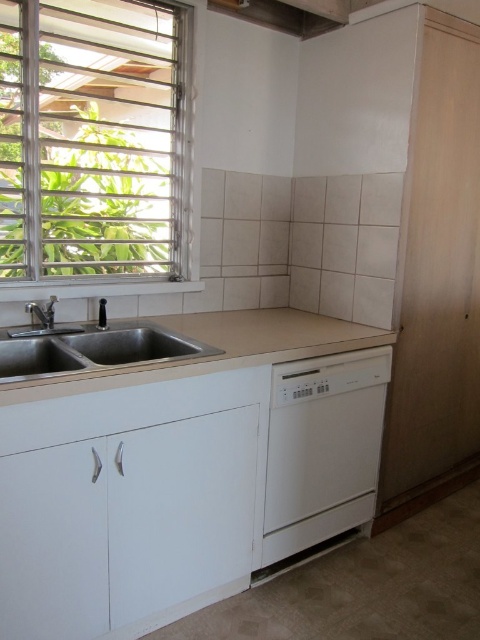
Who is positioned more to the right, stainless steel sink at lower left or brushed metal faucet at left?

stainless steel sink at lower left

Locate an element on the screen. The width and height of the screenshot is (480, 640). stainless steel sink at lower left is located at coordinates (90, 348).

This screenshot has width=480, height=640. Describe the element at coordinates (90, 348) in the screenshot. I see `stainless steel sink at lower left` at that location.

Identify the location of stainless steel sink at lower left. (90, 348).

Does metallic/textured window at upper left have a larger size compared to white matte dishwasher at lower right?

Indeed, metallic/textured window at upper left has a larger size compared to white matte dishwasher at lower right.

Is point (13, 205) more distant than point (332, 384)?

That is True.

Who is more distant from viewer, (x=104, y=116) or (x=334, y=355)?

Point (x=104, y=116)

You are a GUI agent. You are given a task and a screenshot of the screen. Output one action in this format:
    pyautogui.click(x=<x>, y=<y>)
    Task: Click on the metallic/textured window at upper left
    
    Given the screenshot: What is the action you would take?
    pyautogui.click(x=94, y=138)

Can you confirm if stainless steel sink at lower left is positioned to the left of brushed metal faucet at sink left?

Incorrect, stainless steel sink at lower left is not on the left side of brushed metal faucet at sink left.

The height and width of the screenshot is (640, 480). I want to click on stainless steel sink at lower left, so click(x=90, y=348).